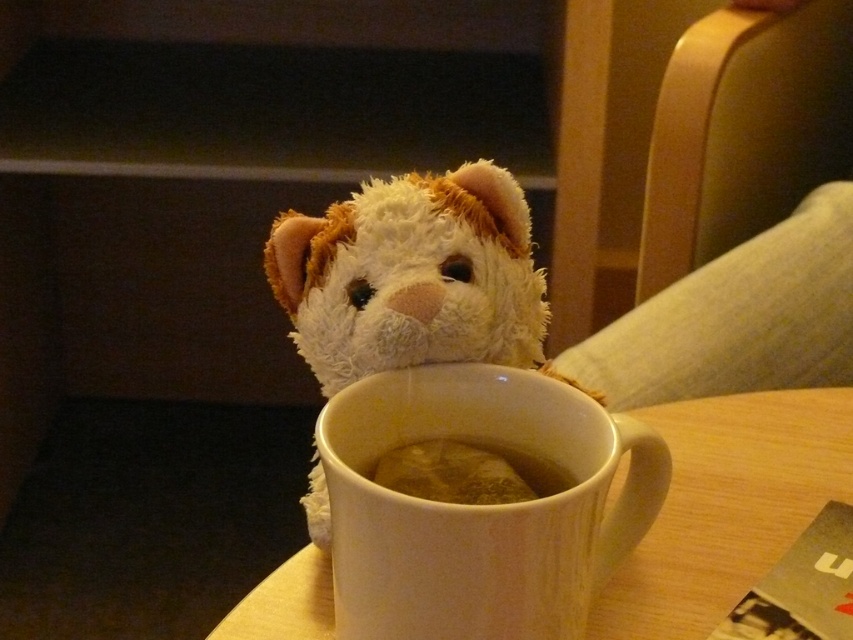
Question: Among these points, which one is nearest to the camera?

Choices:
 (A) (471, 496)
 (B) (595, 468)

Answer: (B)

Question: Does white matte mug at center lie behind brown matte coffee at center?

Choices:
 (A) no
 (B) yes

Answer: (A)

Question: Can you confirm if white matte mug at center is positioned below brown matte coffee at center?

Choices:
 (A) no
 (B) yes

Answer: (B)

Question: Does white matte mug at center have a lesser width compared to brown matte coffee at center?

Choices:
 (A) no
 (B) yes

Answer: (A)